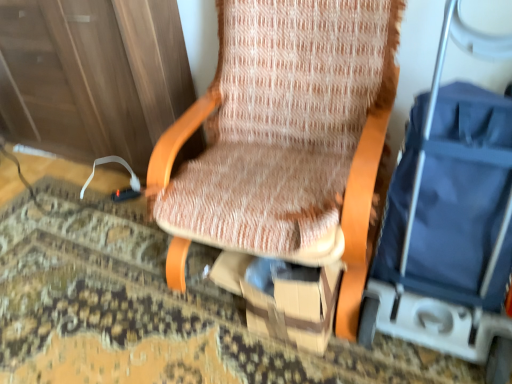
This screenshot has height=384, width=512. Identify the location of free space to the left of brown cardboard box at center. (179, 327).